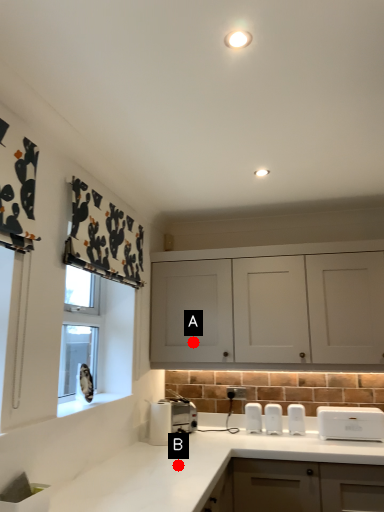
Question: Two points are circled on the image, labeled by A and B beside each circle. Among these points, which one is farthest from the camera?

Choices:
 (A) A is further
 (B) B is further

Answer: (A)